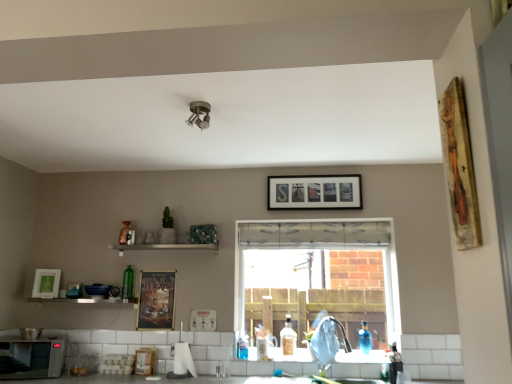
Find the location of `vacant space positioned to the left of blue glass bottle at lower right, positioned as the 2th bottle in right-to-left order`. vacant space positioned to the left of blue glass bottle at lower right, positioned as the 2th bottle in right-to-left order is located at coordinates (348, 359).